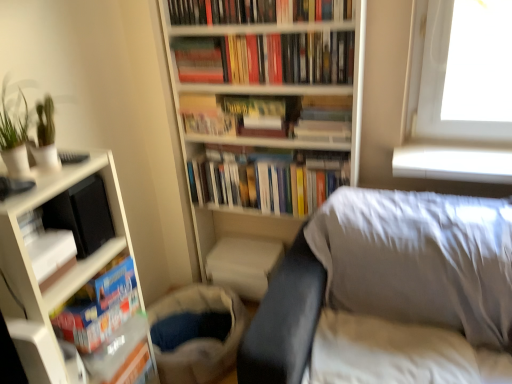
Question: Does hardcover book at center, which is counted as the second paperback book, starting from the right, turn towards white matte bookcase at left, positioned as the 1th bookcase in left-to-right order?

Choices:
 (A) no
 (B) yes

Answer: (B)

Question: From the image's perspective, would you say hardcover book at center, which is counted as the second paperback book, starting from the right, is shown under white matte bookcase at left, which appears as the 2th bookcase when viewed from the right?

Choices:
 (A) yes
 (B) no

Answer: (B)

Question: Are hardcover book at center, the 1th paperback book viewed from the left, and white matte bookcase at left, positioned as the 1th bookcase in left-to-right order, located far from each other?

Choices:
 (A) yes
 (B) no

Answer: (B)

Question: From the image's perspective, is hardcover book at center, the 1th paperback book viewed from the left, above white matte bookcase at left, which appears as the 2th bookcase when viewed from the right?

Choices:
 (A) yes
 (B) no

Answer: (A)

Question: Considering the relative positions of hardcover book at center, the 1th paperback book viewed from the left, and white matte bookcase at left, positioned as the 1th bookcase in left-to-right order, in the image provided, is hardcover book at center, the 1th paperback book viewed from the left, in front of white matte bookcase at left, positioned as the 1th bookcase in left-to-right order,?

Choices:
 (A) no
 (B) yes

Answer: (A)

Question: Does point (247, 100) appear closer or farther from the camera than point (230, 11)?

Choices:
 (A) farther
 (B) closer

Answer: (A)

Question: Is matte brown book at center, which is the 1th paperback book from right to left, to the left or to the right of hardcover books at upper center, the 1th book from the top, in the image?

Choices:
 (A) right
 (B) left

Answer: (A)

Question: Considering the positions of matte brown book at center, which is counted as the 2th paperback book, starting from the left, and hardcover books at upper center, acting as the 7th book starting from the bottom, in the image, is matte brown book at center, which is counted as the 2th paperback book, starting from the left, wider or thinner than hardcover books at upper center, acting as the 7th book starting from the bottom,?

Choices:
 (A) thin
 (B) wide

Answer: (B)

Question: Relative to hardcover books at upper center, acting as the 7th book starting from the bottom, is matte brown book at center, which is the 1th paperback book from right to left, in front or behind?

Choices:
 (A) front
 (B) behind

Answer: (B)

Question: From the image's perspective, relative to hardcover book at upper center, placed as the 6th book when sorted from bottom to top, is hardcover books at center, acting as the 3th book starting from the top, above or below?

Choices:
 (A) above
 (B) below

Answer: (B)

Question: Considering the positions of hardcover books at center, acting as the 3th book starting from the top, and hardcover book at upper center, arranged as the 2th book when viewed from the top, in the image, is hardcover books at center, acting as the 3th book starting from the top, taller or shorter than hardcover book at upper center, arranged as the 2th book when viewed from the top,?

Choices:
 (A) tall
 (B) short

Answer: (B)

Question: From a real-world perspective, is hardcover books at center, acting as the 3th book starting from the top, above or below hardcover book at upper center, arranged as the 2th book when viewed from the top?

Choices:
 (A) above
 (B) below

Answer: (B)

Question: In terms of size, does hardcover books at center, acting as the 3th book starting from the top, appear bigger or smaller than hardcover book at upper center, arranged as the 2th book when viewed from the top?

Choices:
 (A) small
 (B) big

Answer: (B)

Question: Is hardcover books at upper center, the 1th book from the top, taller or shorter than white fabric sheet at lower right?

Choices:
 (A) tall
 (B) short

Answer: (B)

Question: From the image's perspective, relative to white fabric sheet at lower right, is hardcover books at upper center, acting as the 7th book starting from the bottom, above or below?

Choices:
 (A) below
 (B) above

Answer: (B)